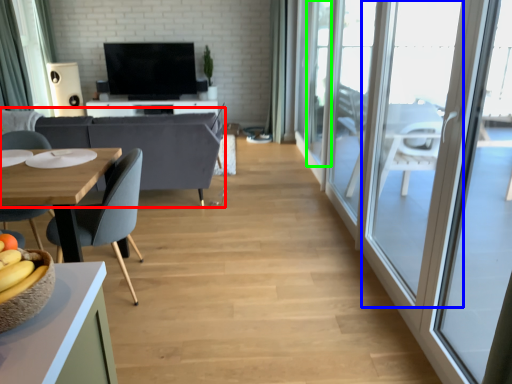
Question: Which object is positioned farthest from couch (highlighted by a red box)? Select from window (highlighted by a blue box) and window (highlighted by a green box).

Choices:
 (A) window
 (B) window

Answer: (A)